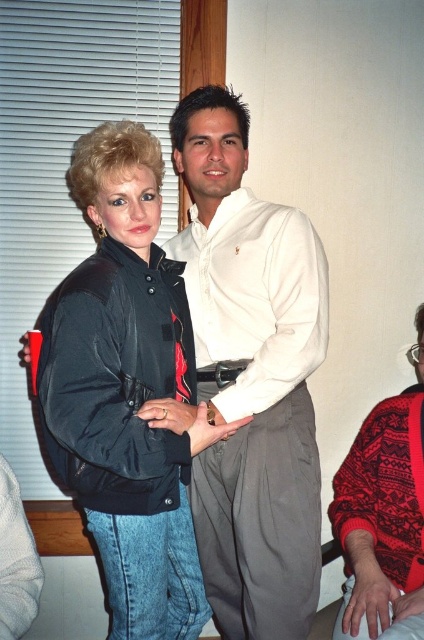
You are standing in a social gathering and want to approach the point at coordinates (122, 339). If you can move forward 5 feet, will you reach that point?

The distance between you and the point at coordinates (122, 339) is 4.78 feet. Since you can move forward 5 feet, you will reach the point.

You are at a party and want to introduce yourself to the person wearing the black leather jacket at center. Which direction should you walk relative to the white smooth shirt at center to reach them?

The white smooth shirt at center is to the right of the black leather jacket at center, so to reach the person wearing the black leather jacket at center, you should walk to the left relative to the white smooth shirt at center.

You are at a social event and need to find the white smooth shirt at center. Based on the scene description, where would you look relative to the other person in the image?

The white smooth shirt at center is located at point coordinates, so you should look towards the center of the image where the man in the white long sleeved shirt is standing close to the woman with his arm around her waist.